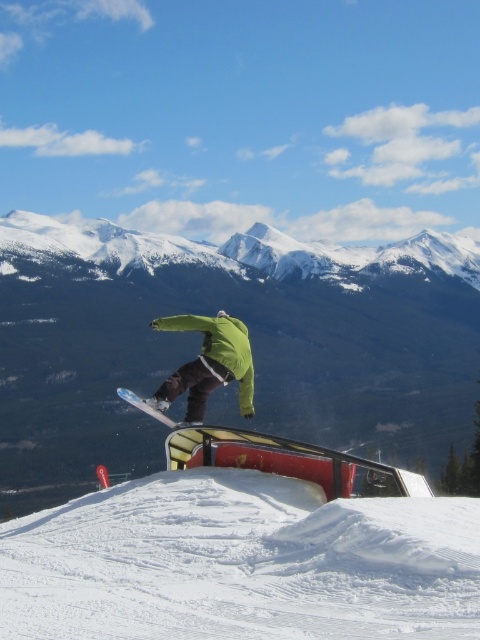
Is white fluffy snow at center shorter than white matte snowboard at center?

Yes.

Who is higher up, white fluffy snow at center or white matte snowboard at center?

white fluffy snow at center

Identify the location of white fluffy snow at center. The width and height of the screenshot is (480, 640). (240, 563).

This screenshot has height=640, width=480. Describe the element at coordinates (208, 364) in the screenshot. I see `green matte snowboarder at center` at that location.

Is point (199, 371) positioned behind point (172, 426)?

Yes.

Measure the distance between point (180, 381) and camera.

Point (180, 381) is 46.37 meters from camera.

I want to click on green matte snowboarder at center, so click(x=208, y=364).

This screenshot has height=640, width=480. Describe the element at coordinates (240, 563) in the screenshot. I see `white fluffy snow at center` at that location.

Can you confirm if white fluffy snow at center is positioned below green matte snowboarder at center?

Indeed, white fluffy snow at center is positioned under green matte snowboarder at center.

Identify the location of white fluffy snow at center. (240, 563).

Identify the location of white fluffy snow at center. (240, 563).